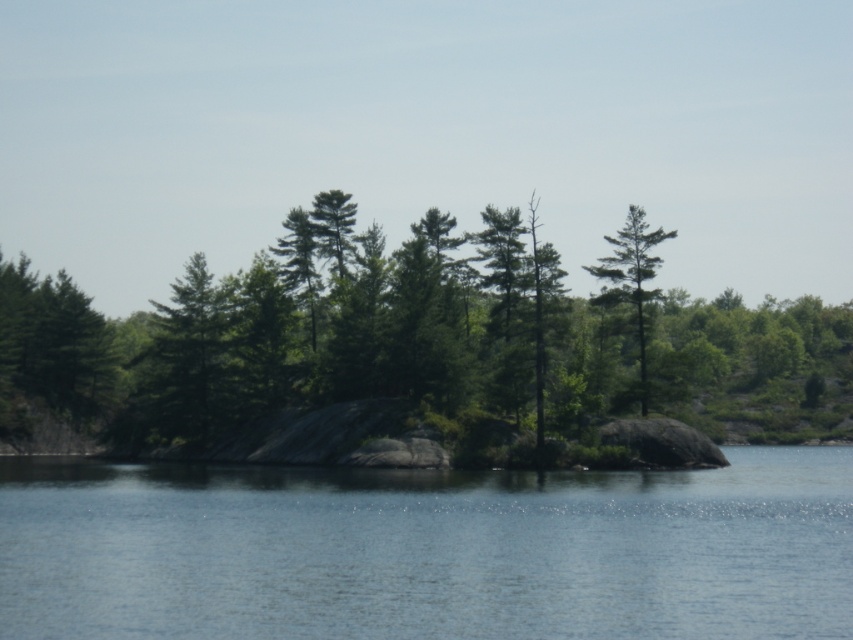
You are a kayaker planning to navigate between the clear blue water at center and the green matte tree at upper right. Given that your kayak requires a minimum of 20 meters of space to safely pass through, can you determine if there is enough space between them?

The clear blue water at center and the green matte tree at upper right are 20.74 meters apart from each other, which is more than the required 20 meters. Therefore, there is enough space for the kayak to safely pass through.

You are a bird looking for a nesting spot. You see the green matte tree at center and the green matte tree at upper right. Which tree would be a better choice if you prefer a taller tree for nesting?

The green matte tree at center is taller than the green matte tree at upper right, so it would be a better choice for nesting if you prefer a taller tree.